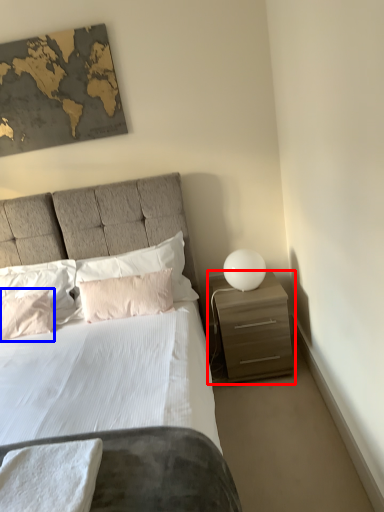
Question: Which of the following is the closest to the observer, nightstand (highlighted by a red box) or pillow (highlighted by a blue box)?

Choices:
 (A) nightstand
 (B) pillow

Answer: (A)